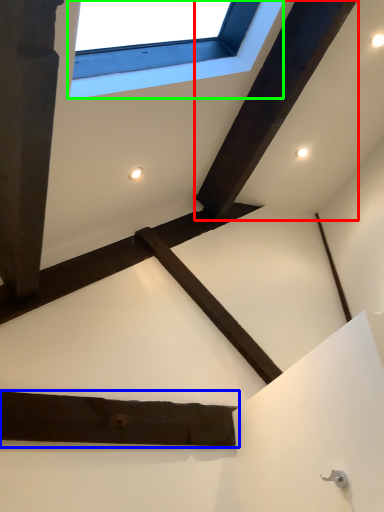
Question: Estimate the real-world distances between objects in this image. Which object is farther from plank (highlighted by a red box), plank (highlighted by a blue box) or window (highlighted by a green box)?

Choices:
 (A) plank
 (B) window

Answer: (A)